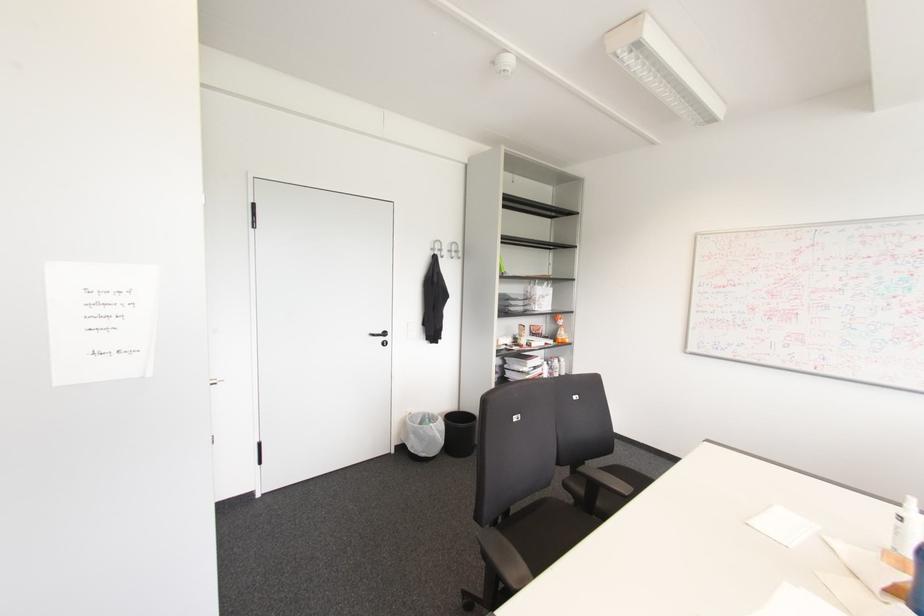
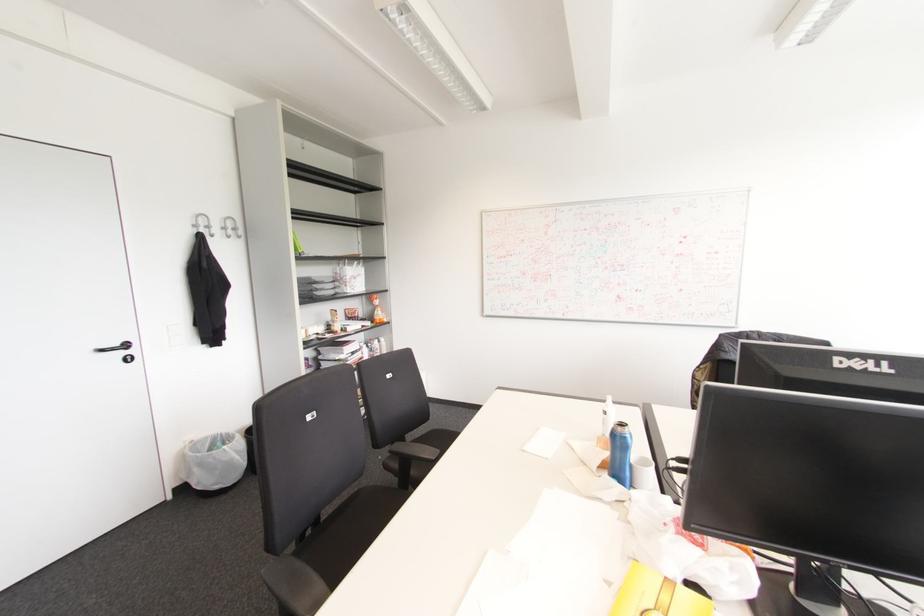
In a continuous first-person perspective shot, in which direction is the camera moving?

The movement direction of the cameraman is right, forward.